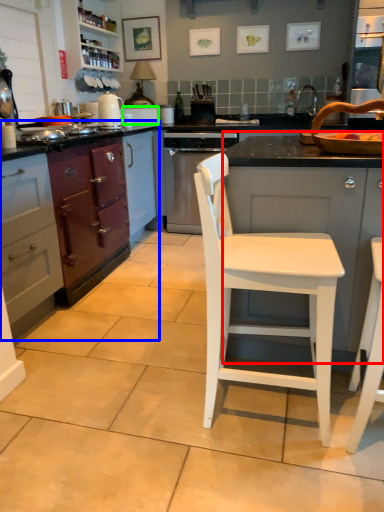
Question: Considering the real-world distances, which object is closest to cabinetry (highlighted by a red box)? cabinetry (highlighted by a blue box) or appliance (highlighted by a green box).

Choices:
 (A) cabinetry
 (B) appliance

Answer: (A)